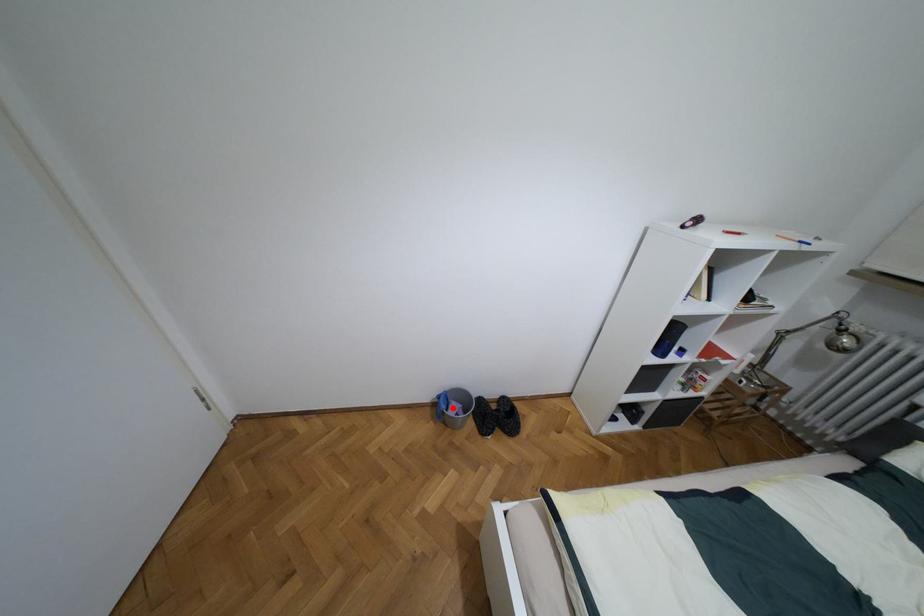
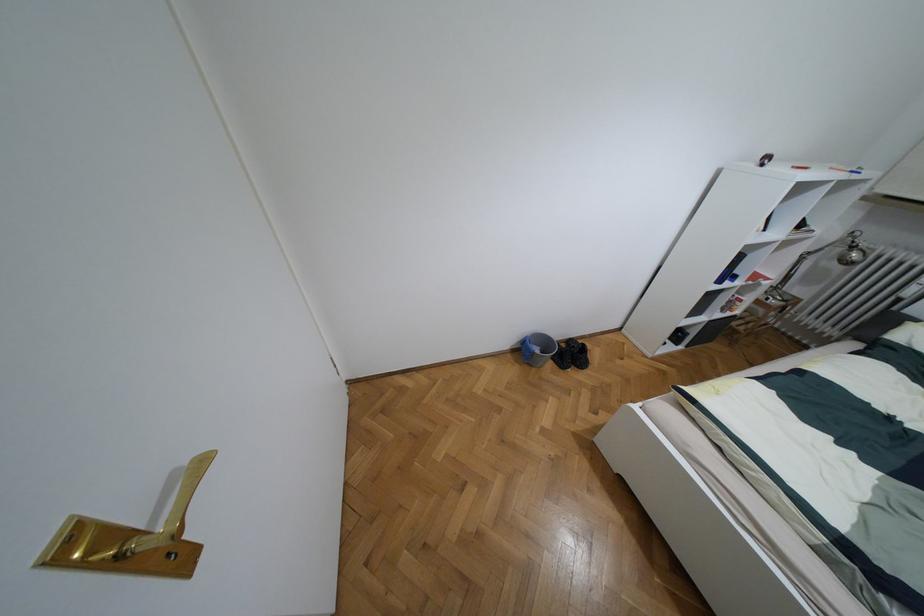
Question: I am providing you with two images of the same scene from different viewpoints. Image1 has a red point marked. In image2, the corresponding 3D location appears at what relative position? Reply with the corresponding letter.

Choices:
 (A) Closer
 (B) Farther

Answer: (A)